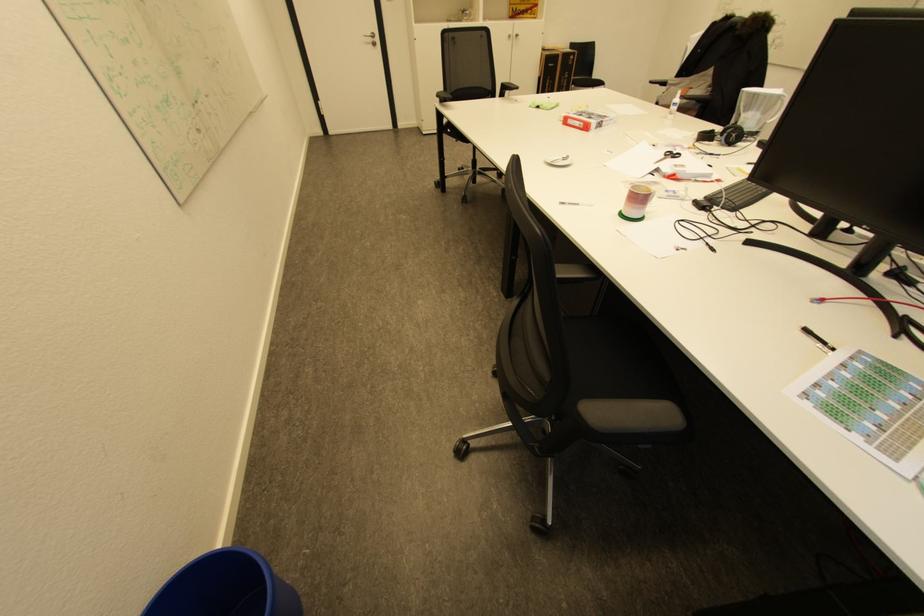
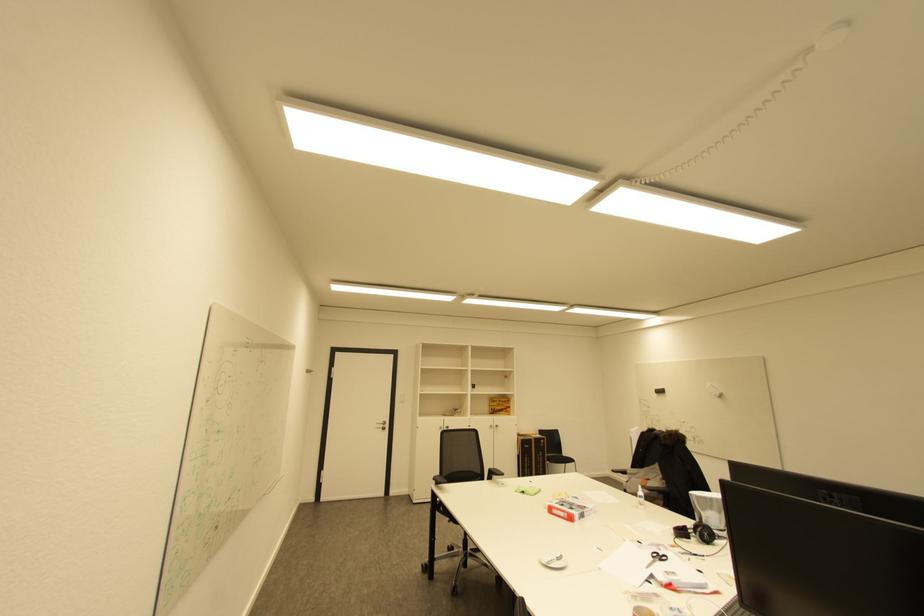
Question: The images are taken continuously from a first-person perspective. In which direction is your viewpoint rotating?

Choices:
 (A) Left
 (B) Right
 (C) Up
 (D) Down

Answer: (C)